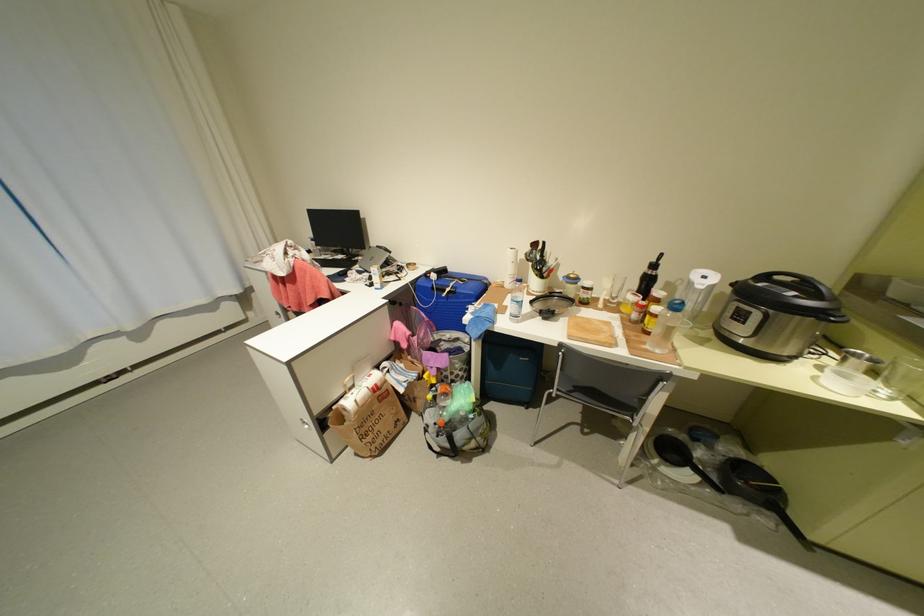
Where is `white drawer handle`? The width and height of the screenshot is (924, 616). white drawer handle is located at coordinates (299, 424).